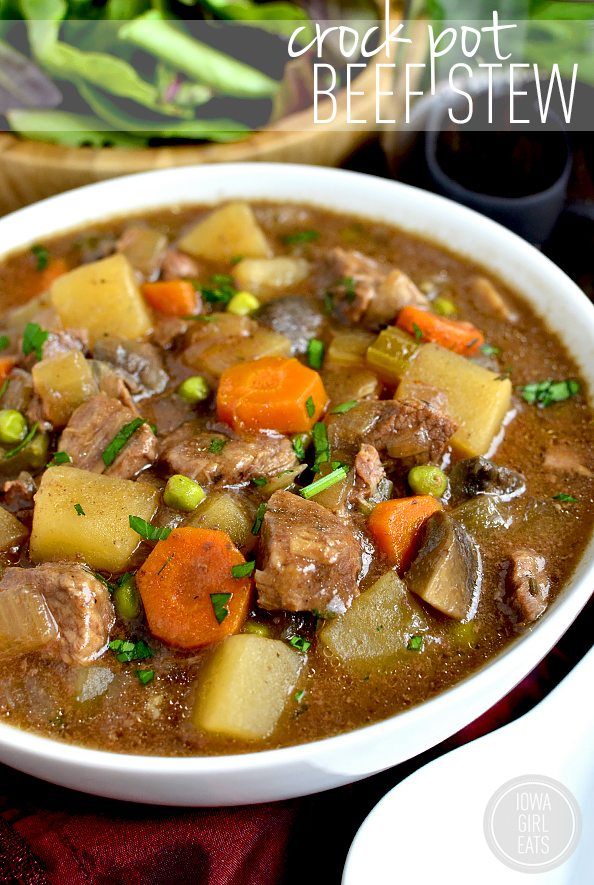
I want to click on wooden bowl, so click(307, 143).